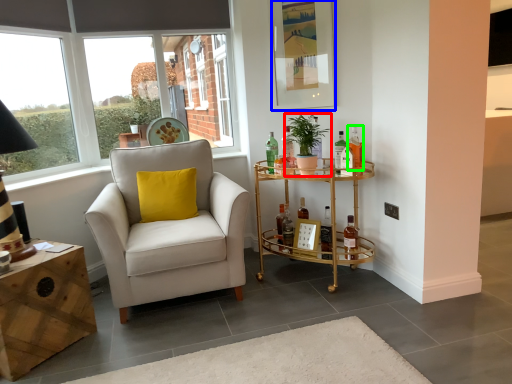
Question: Based on their relative distances, which object is farther from houseplant (highlighted by a red box)? Choose from picture frame (highlighted by a blue box) and bottle (highlighted by a green box).

Choices:
 (A) picture frame
 (B) bottle

Answer: (A)